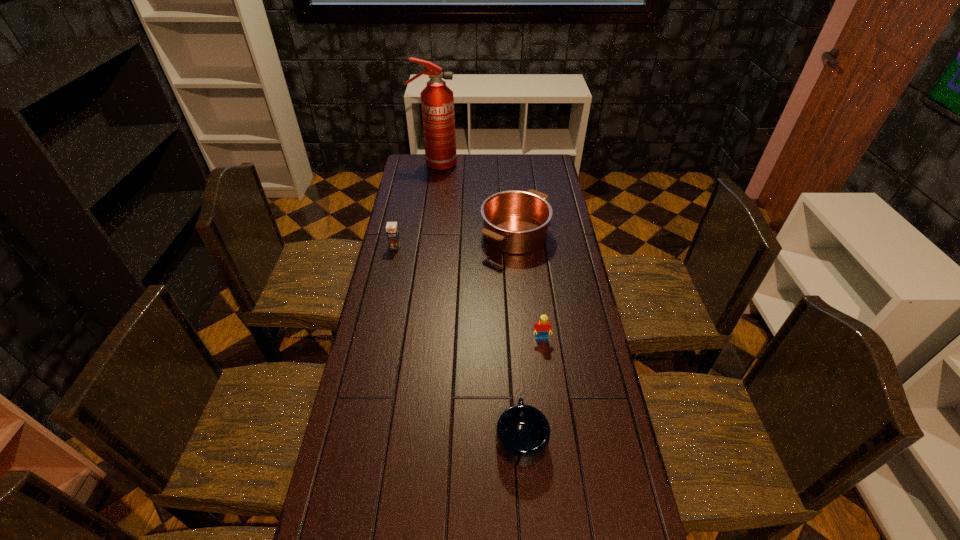
Image resolution: width=960 pixels, height=540 pixels. I want to click on fire extinguisher, so click(437, 100).

Locate an element on the screen. This screenshot has height=540, width=960. the tallest object is located at coordinates (437, 100).

At what (x,y) coordinates should I click in order to perform the action: click on saucepan. Please return your answer as a coordinate pair (x, y). Looking at the image, I should click on (516, 222).

At what (x,y) coordinates should I click in order to perform the action: click on chocolate milk. Please return your answer as a coordinate pair (x, y). The width and height of the screenshot is (960, 540). Looking at the image, I should click on (392, 231).

The image size is (960, 540). Identify the location of Lego. (542, 327).

The image size is (960, 540). I want to click on the nearest object, so coord(522,436).

The height and width of the screenshot is (540, 960). I want to click on the shortest object, so click(x=522, y=436).

The height and width of the screenshot is (540, 960). Find the location of `vacant space situated 0.250m at the nozzle of the farthest object`. vacant space situated 0.250m at the nozzle of the farthest object is located at coordinates (506, 165).

Find the location of a particular element. The image size is (960, 540). free space located on the left of the saucepan is located at coordinates coord(400,234).

Where is `vacant point located on the front label of the chocolate milk`? vacant point located on the front label of the chocolate milk is located at coordinates (392, 263).